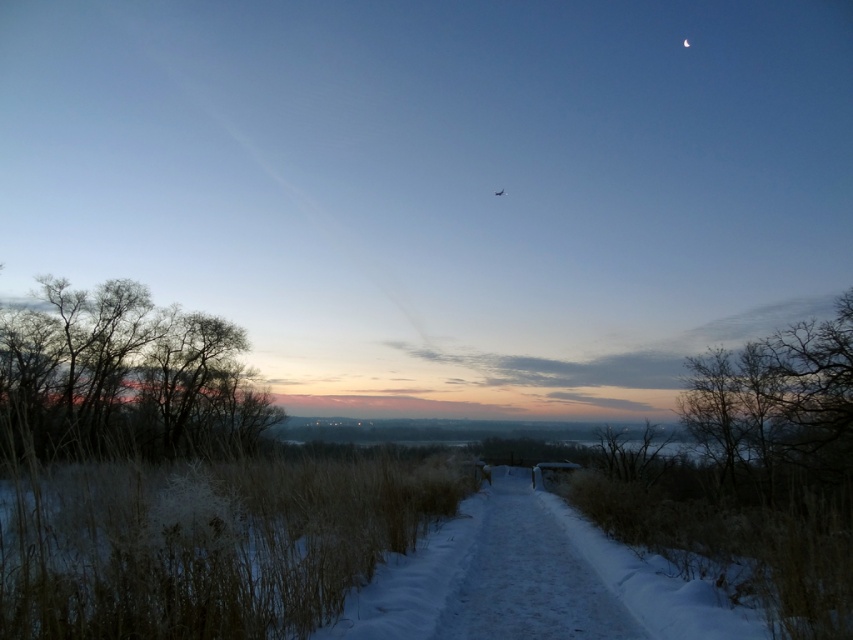
Does point (210, 340) come farther from viewer compared to point (456, 609)?

Yes, it is behind point (456, 609).

Who is more distant from viewer, (91, 333) or (482, 576)?

The point (91, 333) is behind.

Is point (155, 372) less distant than point (512, 620)?

No, (155, 372) is behind (512, 620).

You are a GUI agent. You are given a task and a screenshot of the screen. Output one action in this format:
    pyautogui.click(x=<x>, y=<y>)
    Task: Click on the bare branches at left
    This screenshot has height=640, width=853.
    Given the screenshot: What is the action you would take?
    pyautogui.click(x=123, y=378)